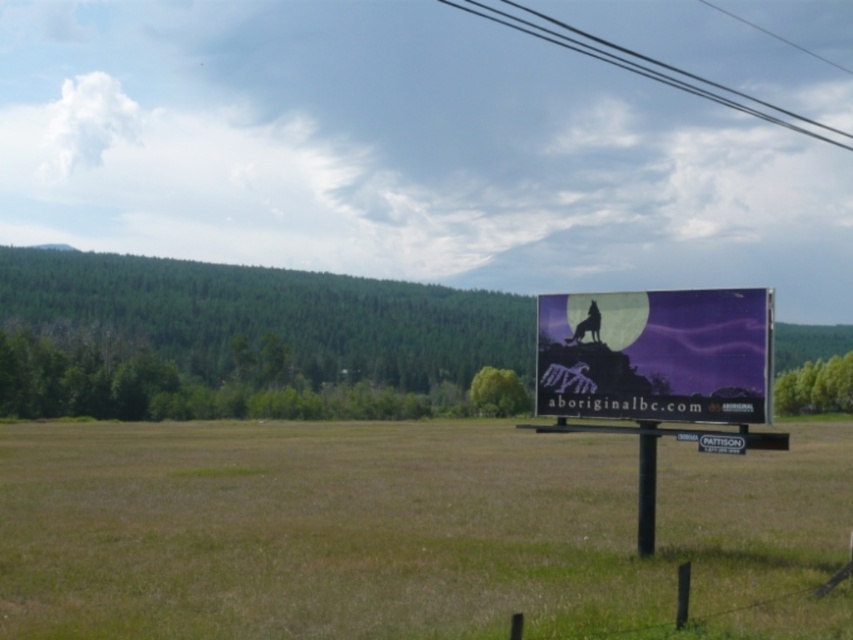
You are standing in the field and want to walk towards the billboard. There are two points marked on the billboard. Which point, point 1 at coordinates (711, 358) or point 2 at coordinates (643, 548), would you reach first?

Point 1 at coordinates (711, 358) is closer to the viewer than point 2 at coordinates (643, 548), so you would reach point 1 first.

You are standing at the point labeled as point (405, 531) in the image. Looking towards the large billboard on the right, which direction would you face?

The point (405, 531) is located at the green grassy field at center. Since the billboard is on the right side of the image, facing towards it would mean turning to your right.